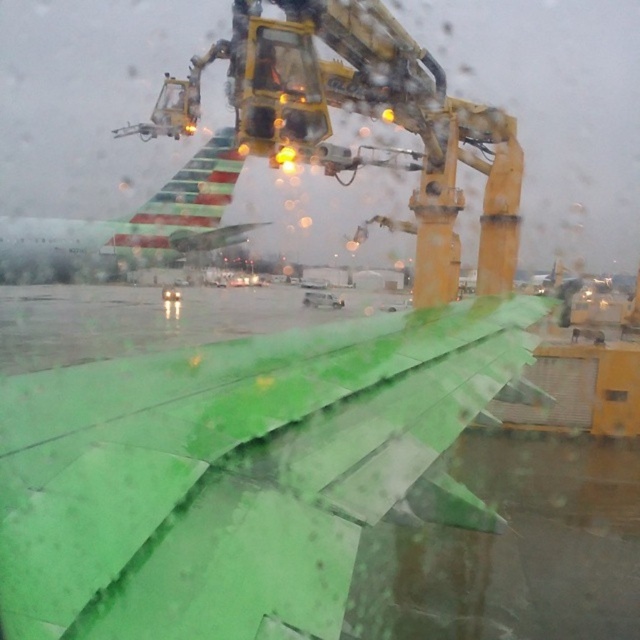
Is point (234, 106) more distant than point (108, 240)?

No, it is in front of (108, 240).

Is yellow metallic crane at upper center wider than green matte airplane wing at upper left?

Yes, yellow metallic crane at upper center is wider than green matte airplane wing at upper left.

Locate an element on the screen. yellow metallic crane at upper center is located at coordinates (364, 115).

Is green matte wing at lower left to the right of green matte airplane wing at upper left from the viewer's perspective?

Correct, you'll find green matte wing at lower left to the right of green matte airplane wing at upper left.

Between point (122, 625) and point (180, 214), which one is positioned behind?

Positioned behind is point (180, 214).

This screenshot has height=640, width=640. I want to click on green matte wing at lower left, so (237, 472).

Between point (253, 588) and point (344, 10), which one is positioned in front?

Point (253, 588) is in front.

Locate an element on the screen. This screenshot has height=640, width=640. green matte wing at lower left is located at coordinates (237, 472).

The height and width of the screenshot is (640, 640). What do you see at coordinates (237, 472) in the screenshot?
I see `green matte wing at lower left` at bounding box center [237, 472].

In order to click on green matte wing at lower left in this screenshot , I will do `click(237, 472)`.